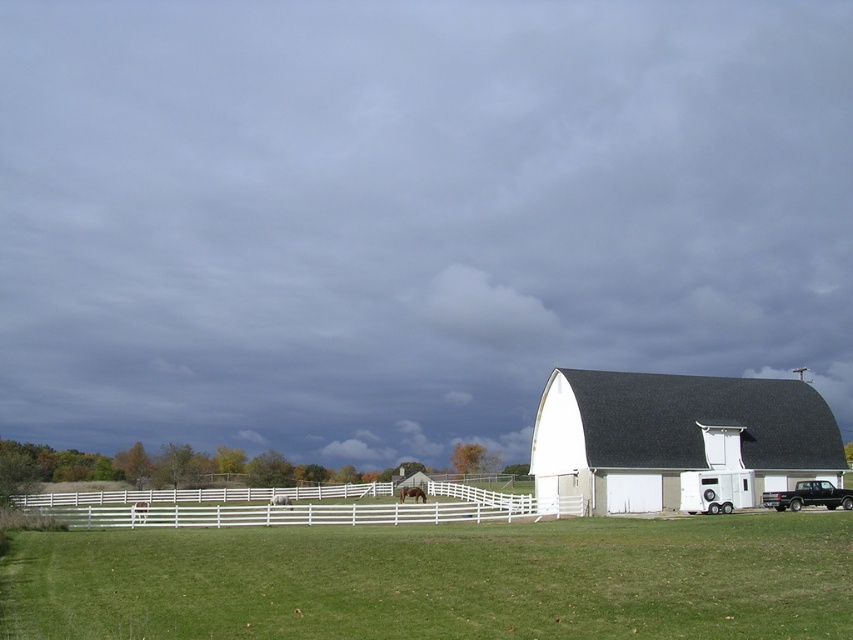
Question: Can you confirm if green grass at lower center is positioned to the left of white matte barn at center-right?

Choices:
 (A) yes
 (B) no

Answer: (A)

Question: Which point appears farthest from the camera in this image?

Choices:
 (A) (675, 396)
 (B) (546, 568)
 (C) (401, 492)
 (D) (225, 518)

Answer: (C)

Question: Does brown matte horse at center have a larger size compared to white glossy horse at center?

Choices:
 (A) yes
 (B) no

Answer: (A)

Question: From the image, what is the correct spatial relationship of white matte barn at center-right in relation to brown matte horse at center?

Choices:
 (A) below
 (B) above

Answer: (B)

Question: Which object appears farthest from the camera in this image?

Choices:
 (A) white wooden fence at lower center
 (B) brown matte horse at center
 (C) green grass at lower center
 (D) white glossy horse at center

Answer: (D)

Question: Among these objects, which one is nearest to the camera?

Choices:
 (A) white matte barn at center-right
 (B) green grass at lower center

Answer: (B)